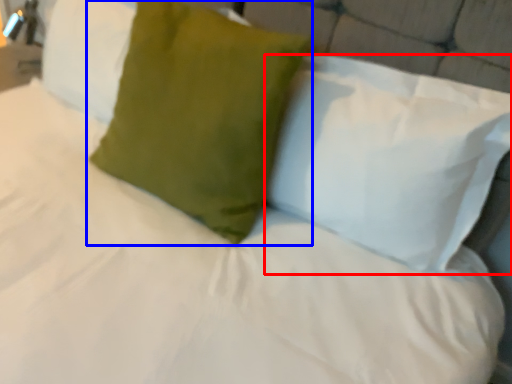
Question: Which object appears closest to the camera in this image, pillow (highlighted by a red box) or pillow (highlighted by a blue box)?

Choices:
 (A) pillow
 (B) pillow

Answer: (A)